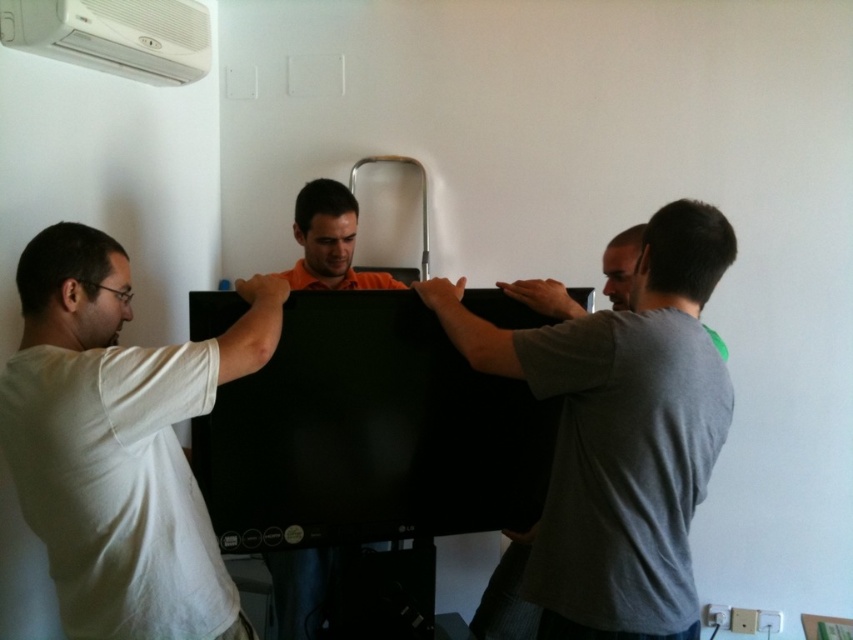
You are standing in the room and see two points marked on the wall. The first point is at coordinates point (143, 42) and the second point is at point (329, 225). Which point is closer to you?

Point (143, 42) is closer to the viewer than point (329, 225).

You are a delivery person who just arrived at the address to deliver a package. You notice two items in the scene described. Which item is larger in size between the white matte shirt at left and the white plastic air conditioning unit at upper left?

The white matte shirt at left is bigger than the white plastic air conditioning unit at upper left.